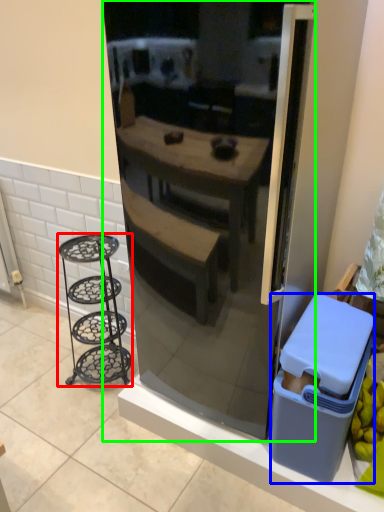
Question: Estimate the real-world distances between objects in this image. Which object is closer to furniture (highlighted by a red box), trash bin/can (highlighted by a blue box) or refrigerator (highlighted by a green box)?

Choices:
 (A) trash bin/can
 (B) refrigerator

Answer: (B)